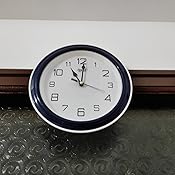
You are a GUI agent. You are given a task and a screenshot of the screen. Output one action in this format:
    pyautogui.click(x=<x>, y=<y>)
    Task: Click on the wood molding
    
    Given the screenshot: What is the action you would take?
    pyautogui.click(x=137, y=76)